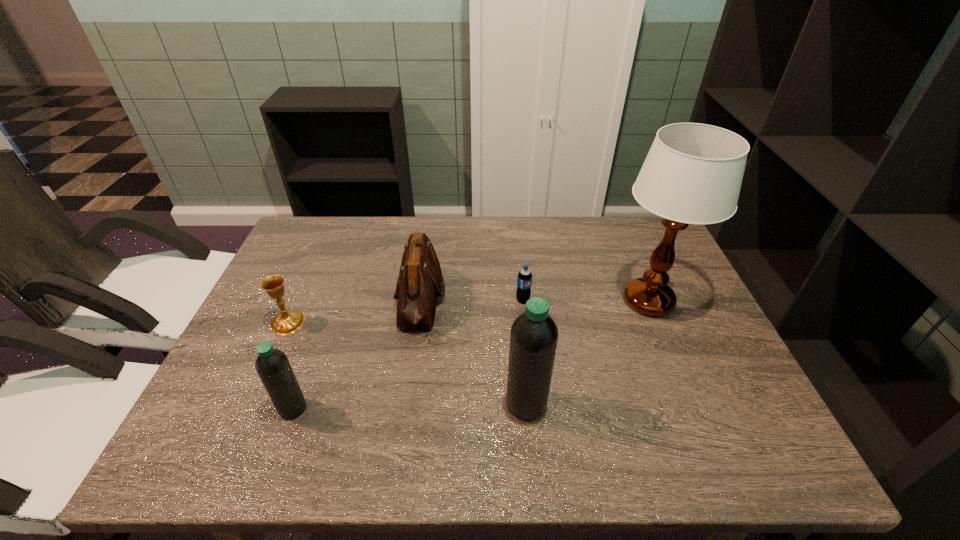
Image resolution: width=960 pixels, height=540 pixels. Find the location of `free space located 0.160m on the back of the taller water bottle`. free space located 0.160m on the back of the taller water bottle is located at coordinates (519, 334).

You are a GUI agent. You are given a task and a screenshot of the screen. Output one action in this format:
    pyautogui.click(x=<x>, y=<y>)
    Task: Click on the vacant space located 0.120m on the back of the chalice
    The image size is (960, 540).
    Given the screenshot: What is the action you would take?
    [306, 281]

Find the location of a particular element. free space located on the back of the soda bottle is located at coordinates (516, 229).

Where is `vacant area situated on the back of the table lamp`? This screenshot has height=540, width=960. vacant area situated on the back of the table lamp is located at coordinates tap(621, 234).

The width and height of the screenshot is (960, 540). Find the location of `free location located 0.350m on the right of the shoulder bag`. free location located 0.350m on the right of the shoulder bag is located at coordinates (573, 298).

Find the location of a particular element. object at the left edge is located at coordinates (288, 322).

The width and height of the screenshot is (960, 540). I want to click on object present at the right edge, so click(693, 172).

In the image, there is a desktop. Where is `vacant space at the far edge`? The width and height of the screenshot is (960, 540). vacant space at the far edge is located at coordinates (430, 224).

Where is `vacant space at the near edge`? The image size is (960, 540). vacant space at the near edge is located at coordinates (346, 402).

At what (x,y) coordinates should I click in order to perform the action: click on vacant point at the right edge. Please return your answer as a coordinate pair (x, y). Looking at the image, I should click on (683, 381).